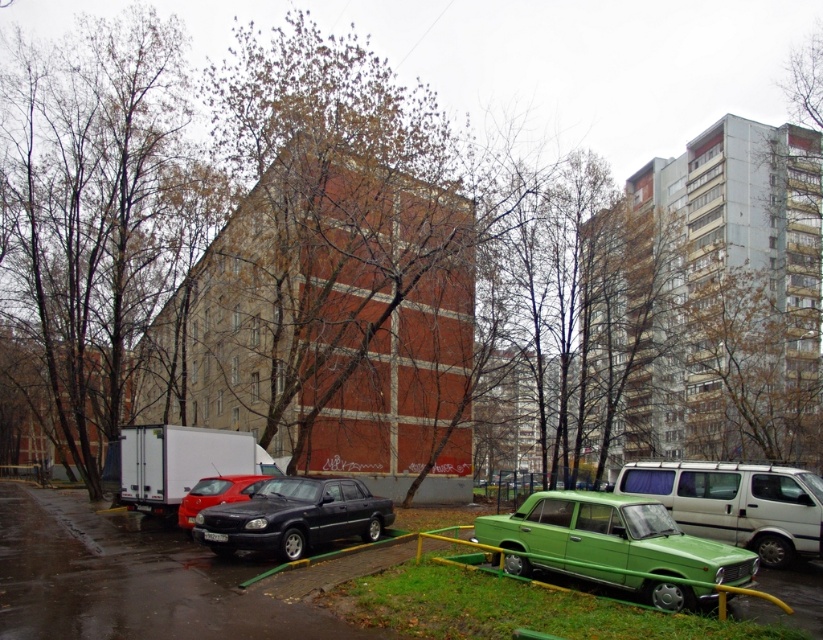
Based on the photo, is white matte van at center thinner than shiny red sedan at center?

No, white matte van at center is not thinner than shiny red sedan at center.

Which is more to the left, white matte van at center or shiny red sedan at center?

Positioned to the left is shiny red sedan at center.

Image resolution: width=823 pixels, height=640 pixels. What are the coordinates of `white matte van at center` in the screenshot? It's located at (737, 502).

The width and height of the screenshot is (823, 640). I want to click on white matte van at center, so click(x=737, y=502).

Who is more distant from viewer, [205,627] or [284,522]?

Positioned behind is point [284,522].

Does green matte car at center have a greater width compared to shiny black sedan at center?

Yes, green matte car at center is wider than shiny black sedan at center.

At what (x,y) coordinates should I click in order to perform the action: click on green matte car at center. Please return your answer as a coordinate pair (x, y). This screenshot has width=823, height=640. Looking at the image, I should click on (129, 579).

Does metallic silver minivan at center appear over white matte van at center?

Yes.

Is metallic silver minivan at center positioned in front of white matte van at center?

Yes, metallic silver minivan at center is closer to the viewer.

Locate an element on the screen. The width and height of the screenshot is (823, 640). metallic silver minivan at center is located at coordinates (614, 547).

This screenshot has height=640, width=823. In order to click on metallic silver minivan at center in this screenshot , I will do `click(614, 547)`.